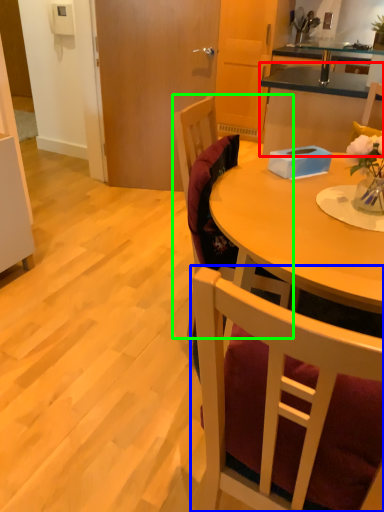
Question: Which is farther away from cabinetry (highlighted by a red box)? chair (highlighted by a blue box) or chair (highlighted by a green box)?

Choices:
 (A) chair
 (B) chair

Answer: (A)